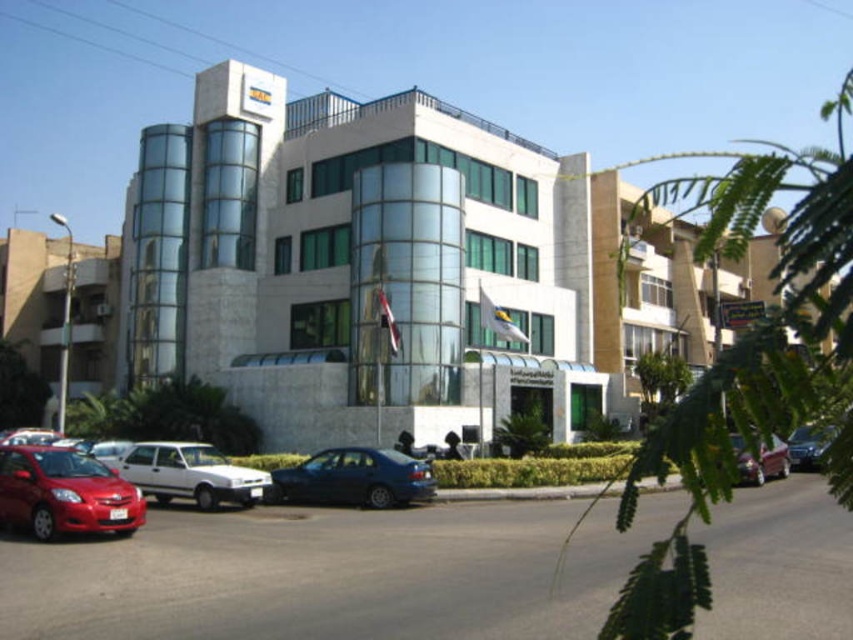
Question: Is shiny red sedan at lower left positioned before shiny red sedan at lower right?

Choices:
 (A) yes
 (B) no

Answer: (B)

Question: Can you confirm if shiny red sedan at lower left is thinner than metallic blue sedan at center?

Choices:
 (A) yes
 (B) no

Answer: (A)

Question: Which point is closer to the camera?

Choices:
 (A) (242, 490)
 (B) (828, 442)

Answer: (B)

Question: Which of these objects is positioned farthest from the white marble building at center?

Choices:
 (A) shiny blue sedan at center
 (B) metallic blue sedan at center
 (C) shiny red sedan at lower right
 (D) shiny red sedan at lower left

Answer: (D)

Question: Which of the following is the farthest from the observer?

Choices:
 (A) (773, 444)
 (B) (202, 211)
 (C) (801, 460)

Answer: (B)

Question: Does shiny blue sedan at center come behind shiny red sedan at lower right?

Choices:
 (A) yes
 (B) no

Answer: (A)